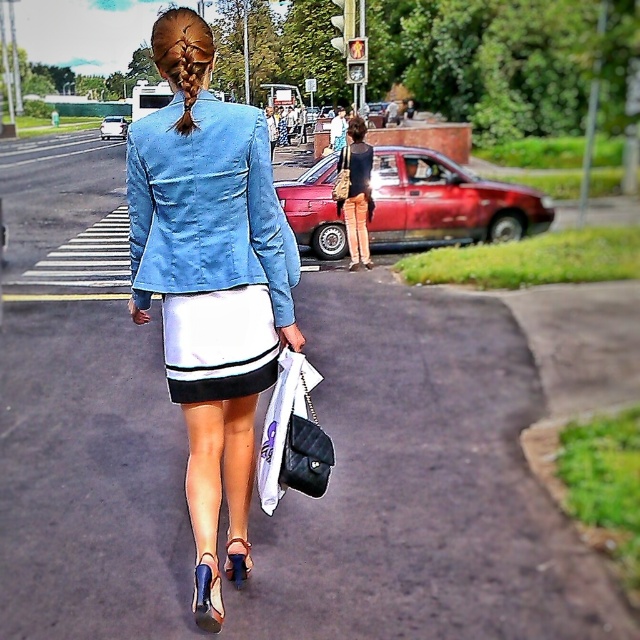
In the scene shown: You are a fashion designer observing the woman in the image. You need to determine which item is wider between the denim jacket at center and the black leather handbag at center. Which one is wider?

The denim jacket at center is wider than the black leather handbag at center according to the description.

You are a fashion designer observing the woman from behind. You need to determine the spatial relationship between the denim jacket at center and the black leather handbag at center. Which one is positioned lower on her body?

The denim jacket at center is located below the black leather handbag at center, so the denim jacket at center is positioned lower on her body.